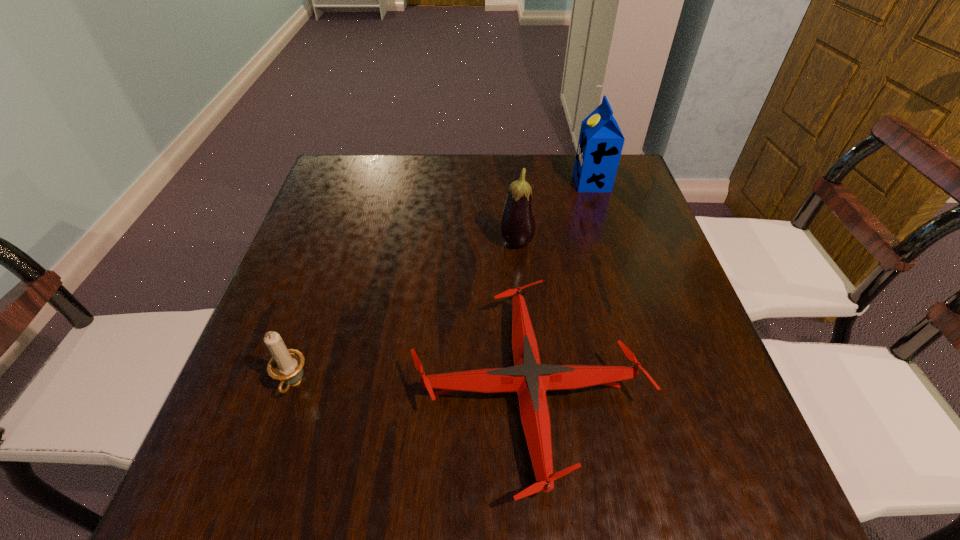
Where is `free space at the left edge`? The width and height of the screenshot is (960, 540). free space at the left edge is located at coordinates (255, 368).

The width and height of the screenshot is (960, 540). Find the location of `free space at the right edge`. free space at the right edge is located at coordinates (634, 318).

Find the location of a particular element. Image resolution: width=960 pixels, height=540 pixels. vacant area at the far left corner is located at coordinates (374, 177).

Find the location of `free location at the near left corner`. free location at the near left corner is located at coordinates (200, 482).

Find the location of a particular element. The image size is (960, 540). vacant region at the far right corner of the desktop is located at coordinates (616, 176).

Where is `free area in between the third tallest object and the eggplant`? The image size is (960, 540). free area in between the third tallest object and the eggplant is located at coordinates (405, 314).

Identify the location of free space between the candle_holder and the eggplant. The image size is (960, 540). (405, 314).

Find the location of `vacant region between the eggplant and the carton`. vacant region between the eggplant and the carton is located at coordinates (554, 213).

What are the coordinates of `blank region between the third tallest object and the farthest object` in the screenshot? It's located at (443, 284).

Identify the location of free space between the eggplant and the farthest object. (554, 213).